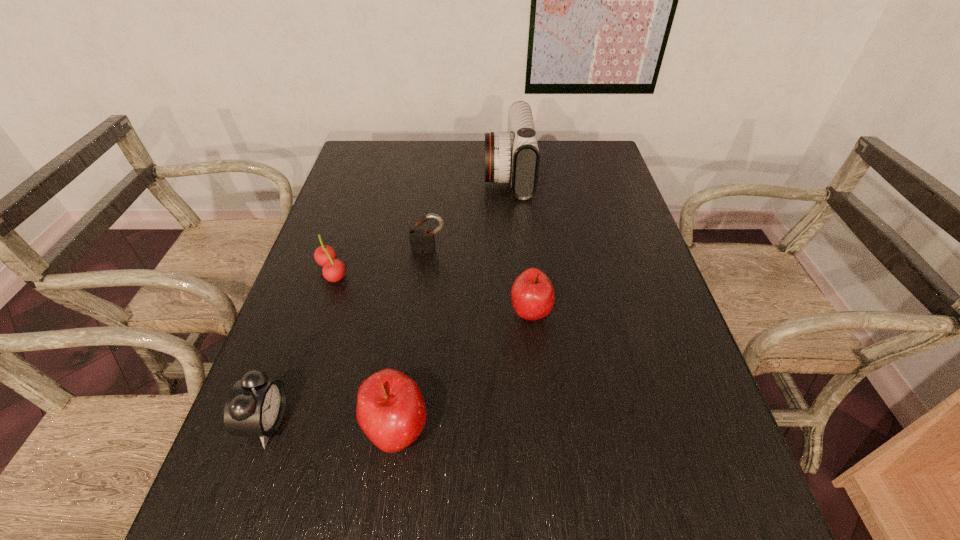
Where is `vacant point located on the right of the taller apple`? The height and width of the screenshot is (540, 960). vacant point located on the right of the taller apple is located at coordinates (531, 431).

You are a GUI agent. You are given a task and a screenshot of the screen. Output one action in this format:
    pyautogui.click(x=<x>, y=<y>)
    Task: Click on the vacant space located on the front of the shorter apple
    This screenshot has height=540, width=960.
    Given the screenshot: What is the action you would take?
    pyautogui.click(x=538, y=376)

Identify the location of free spot located 0.080m on the surface of the camcorder. click(x=460, y=174).

The width and height of the screenshot is (960, 540). In order to click on free location located 0.210m on the surface of the camcorder in this screenshot , I will do `click(420, 174)`.

At what (x,y) coordinates should I click in order to perform the action: click on vacant area located on the surface of the camcorder. Please return your answer as a coordinate pair (x, y). Looking at the image, I should click on (445, 174).

Identify the location of vacant space situated on the front side of the alarm clock. (464, 422).

The image size is (960, 540). What are the coordinates of `free spot located with the keyhole on the front of the padlock` in the screenshot? It's located at (425, 283).

Locate an element on the screen. The width and height of the screenshot is (960, 540). vacant space positioned 0.290m on the right of the cherry is located at coordinates (463, 272).

In order to click on object that is positioned at the far edge in this screenshot , I will do `click(513, 156)`.

This screenshot has height=540, width=960. I want to click on apple at the near edge, so click(390, 410).